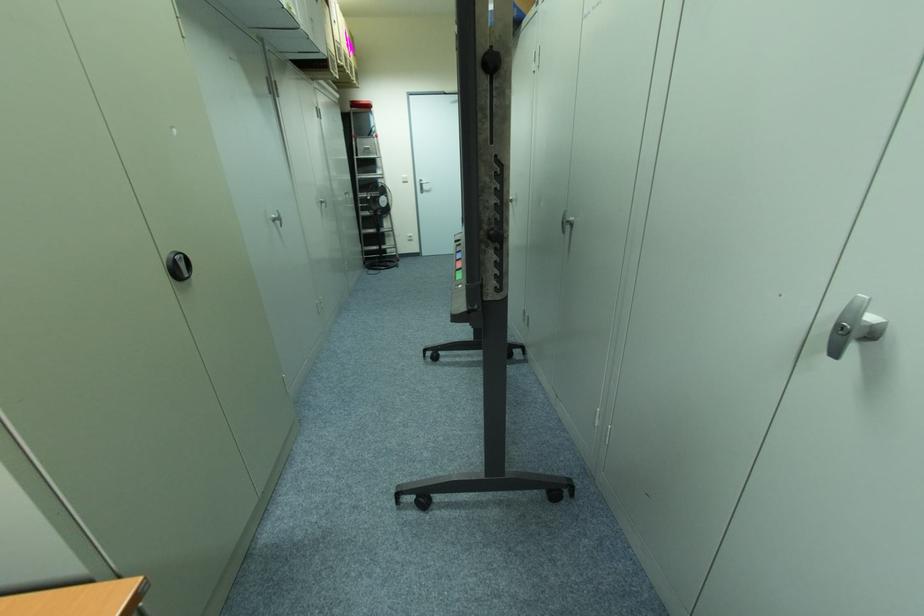
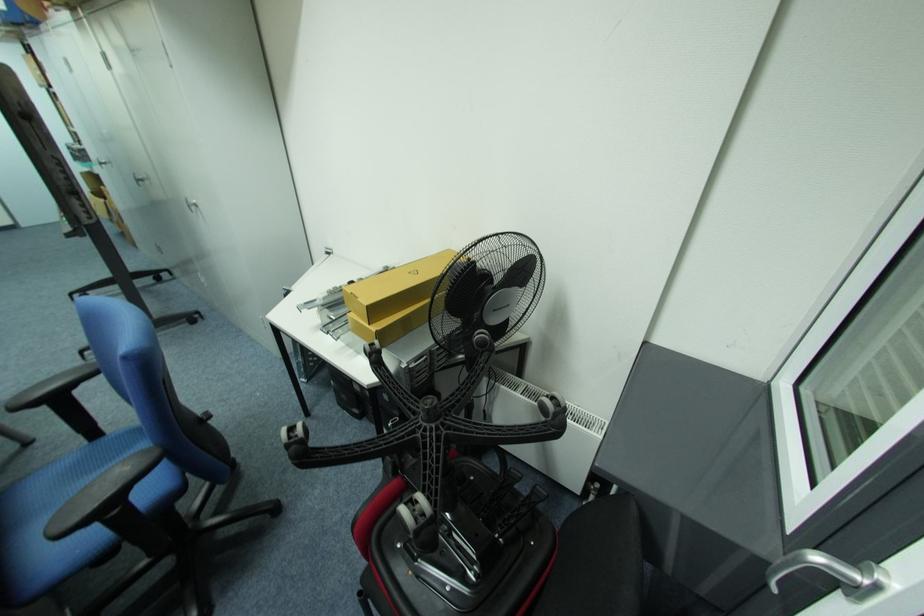
Locate, in the second image, the point that corresponds to (572,219) in the first image.

(141, 179)